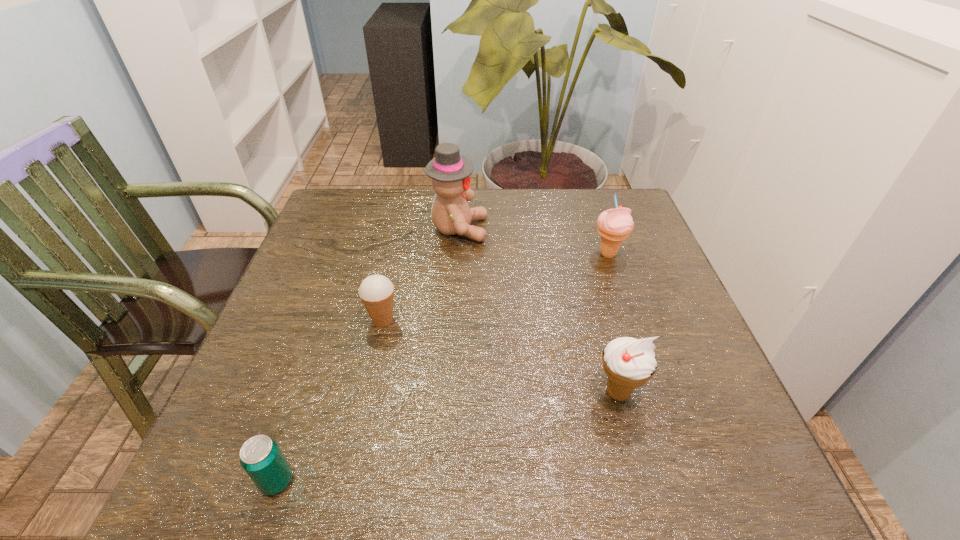
In the image, there is a desktop. Where is `free space at the far right corner`? free space at the far right corner is located at coordinates (578, 195).

Find the location of a particular element. The image size is (960, 540). empty space that is in between the third object from right to left and the leftmost object is located at coordinates (368, 355).

Identify the location of vacant point located between the nearest icecream and the farthest icecream. This screenshot has height=540, width=960. (612, 323).

Identify the location of empty space between the farthest icecream and the second nearest object. Image resolution: width=960 pixels, height=540 pixels. pyautogui.click(x=612, y=323).

What are the coordinates of `empty space that is in between the third object from right to left and the second nearest object` in the screenshot? It's located at click(x=539, y=310).

Where is `free area in between the shortest icecream and the leftmost object`? The height and width of the screenshot is (540, 960). free area in between the shortest icecream and the leftmost object is located at coordinates (329, 400).

Where is `free space between the tallest object and the farthest icecream`? free space between the tallest object and the farthest icecream is located at coordinates (534, 241).

Locate an element on the screen. This screenshot has height=540, width=960. free space between the third farthest object and the second nearest object is located at coordinates (500, 356).

This screenshot has height=540, width=960. What are the coordinates of `free space that is in between the tallest object and the second nearest icecream` in the screenshot? It's located at (420, 274).

Where is `free space that is in between the shortest icecream and the farthest icecream`? free space that is in between the shortest icecream and the farthest icecream is located at coordinates (495, 287).